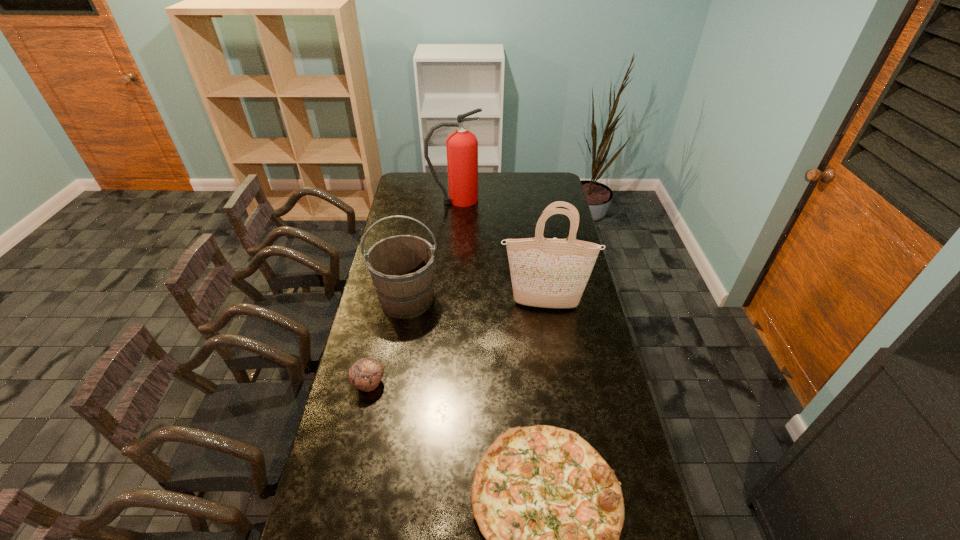
Find the location of a particular element. Image resolution: width=960 pixels, height=540 pixels. object that is the third closest to the third tallest object is located at coordinates (551, 509).

Find the location of `the second closest object to the shortest object`. the second closest object to the shortest object is located at coordinates (401, 267).

I want to click on free space in the image that satisfies the following two spatial constraints: 1. on the handle side of the fire extinguisher; 2. on the right side of the shopping bag, so click(448, 305).

Locate an element on the screen. The height and width of the screenshot is (540, 960). free space that satisfies the following two spatial constraints: 1. on the handle side of the fire extinguisher; 2. on the right side of the shopping bag is located at coordinates (448, 305).

Where is `vacant space that satisfies the following two spatial constraints: 1. on the handle side of the fire extinguisher; 2. on the right side of the shopping bag`? This screenshot has width=960, height=540. vacant space that satisfies the following two spatial constraints: 1. on the handle side of the fire extinguisher; 2. on the right side of the shopping bag is located at coordinates (448, 305).

Where is `vacant space that satisfies the following two spatial constraints: 1. on the handle side of the shopping bag; 2. on the right side of the farthest object`? vacant space that satisfies the following two spatial constraints: 1. on the handle side of the shopping bag; 2. on the right side of the farthest object is located at coordinates (448, 305).

At what (x,y) coordinates should I click in order to perform the action: click on vacant space that satisfies the following two spatial constraints: 1. on the back side of the shopping bag; 2. on the right side of the muffin. Please return your answer as a coordinate pair (x, y). This screenshot has height=540, width=960. Looking at the image, I should click on (386, 305).